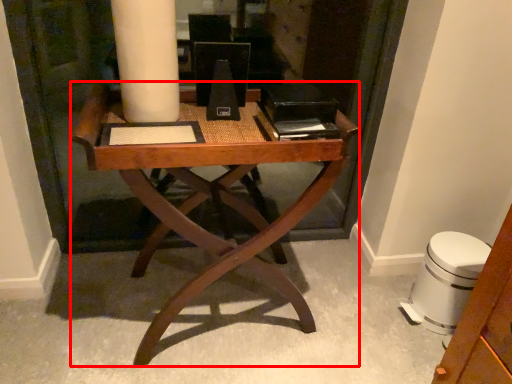
Question: From the image's perspective, where is desk (annotated by the red box) located in relation to swivel chair in the image?

Choices:
 (A) below
 (B) above

Answer: (B)